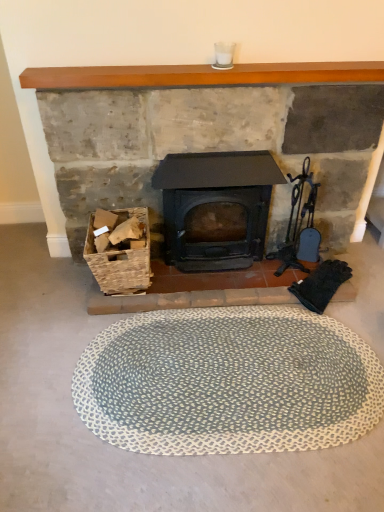
At what (x,y) coordinates should I click in order to perform the action: click on vacant space underneath blue textured bath mat at center (from a real-world perspective). Please return your answer as a coordinate pair (x, y). Looking at the image, I should click on (196, 384).